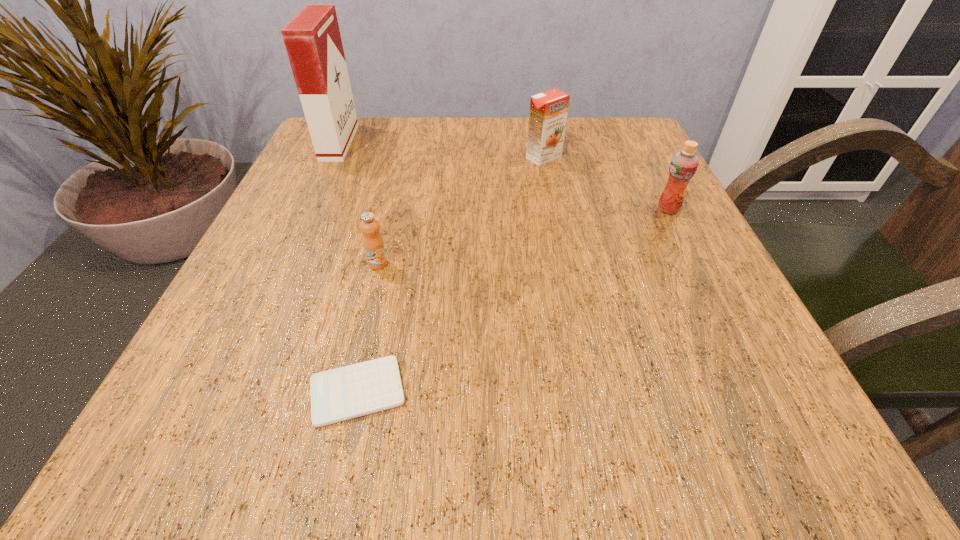
This screenshot has height=540, width=960. In order to click on free spot located 0.240m on the front-facing side of the tallest object in this screenshot , I will do `click(458, 143)`.

Where is `vacant space located on the front of the farthest orange juice`? vacant space located on the front of the farthest orange juice is located at coordinates (565, 265).

Where is `free space located 0.160m on the left of the second farthest orange juice`? free space located 0.160m on the left of the second farthest orange juice is located at coordinates (570, 209).

Find the location of `vacant point located on the front label of the leftmost orange juice`. vacant point located on the front label of the leftmost orange juice is located at coordinates (334, 449).

Find the location of a particular element. The width and height of the screenshot is (960, 540). free location located on the right of the shortest object is located at coordinates (712, 392).

Image resolution: width=960 pixels, height=540 pixels. I want to click on cigarette_case positioned at the far edge, so click(312, 38).

Locate an element on the screen. The image size is (960, 540). orange juice that is positioned at the far edge is located at coordinates (548, 113).

This screenshot has height=540, width=960. Find the location of `object present at the near edge`. object present at the near edge is located at coordinates pos(360,389).

Where is `object at the left edge`? object at the left edge is located at coordinates (312, 38).

Locate an element on the screen. This screenshot has width=960, height=540. object that is at the right edge is located at coordinates (684, 163).